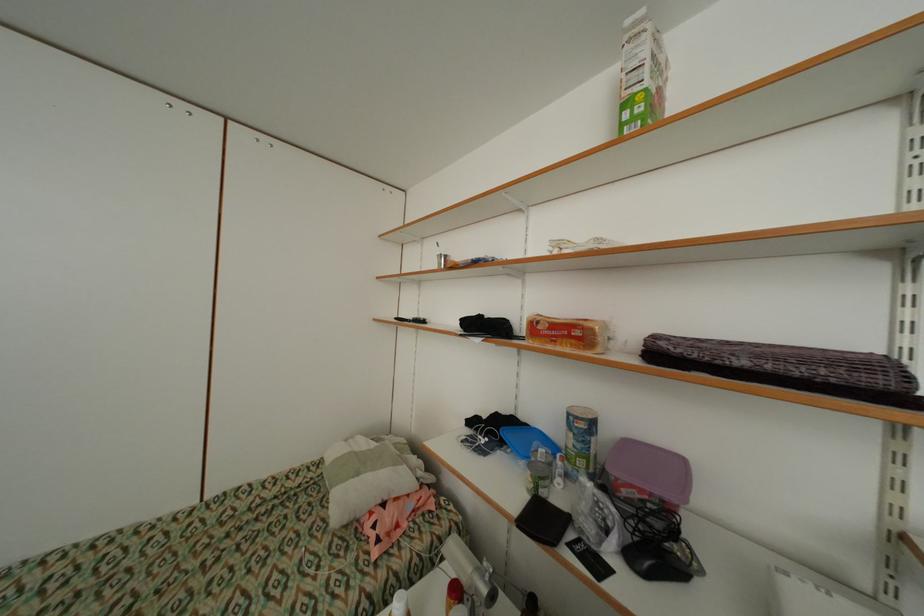
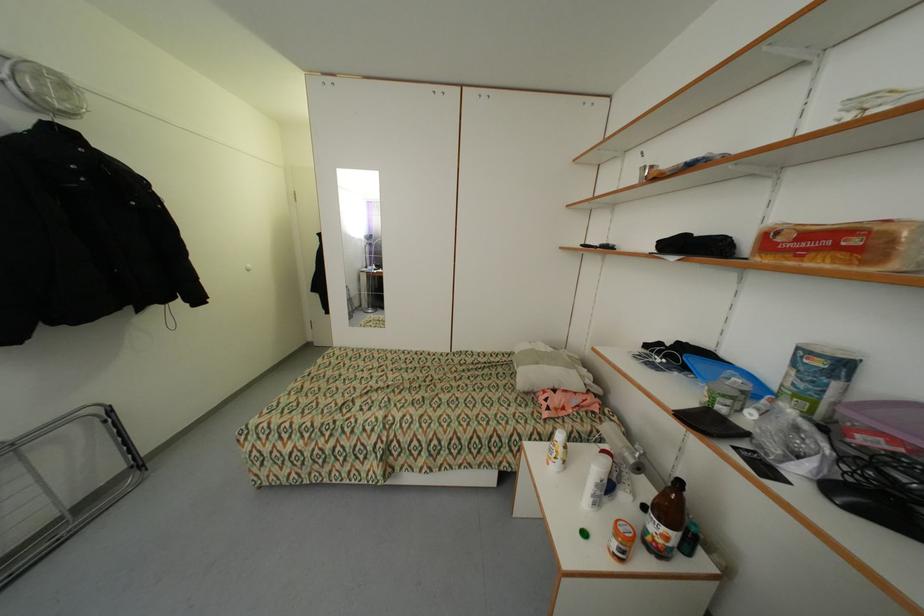
Locate, in the second image, the point that corresponds to point 647,490 in the first image.

(900, 440)